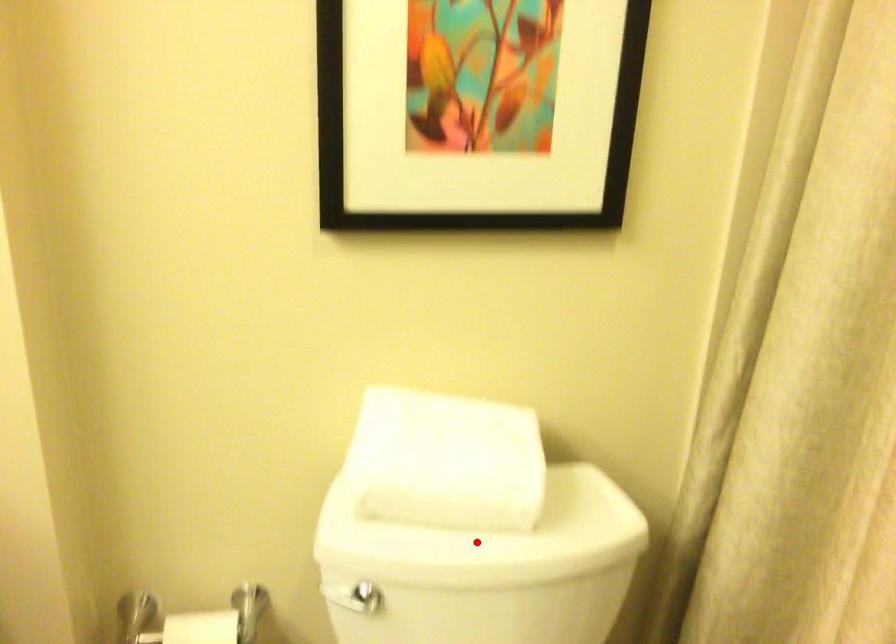
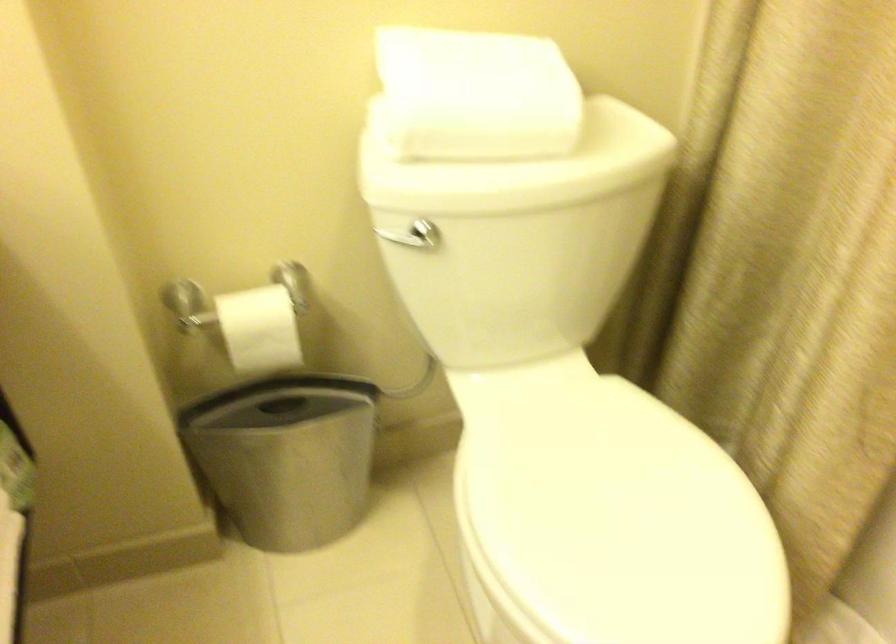
Locate, in the second image, the point that corresponds to the highlighted location in the first image.

(519, 167)